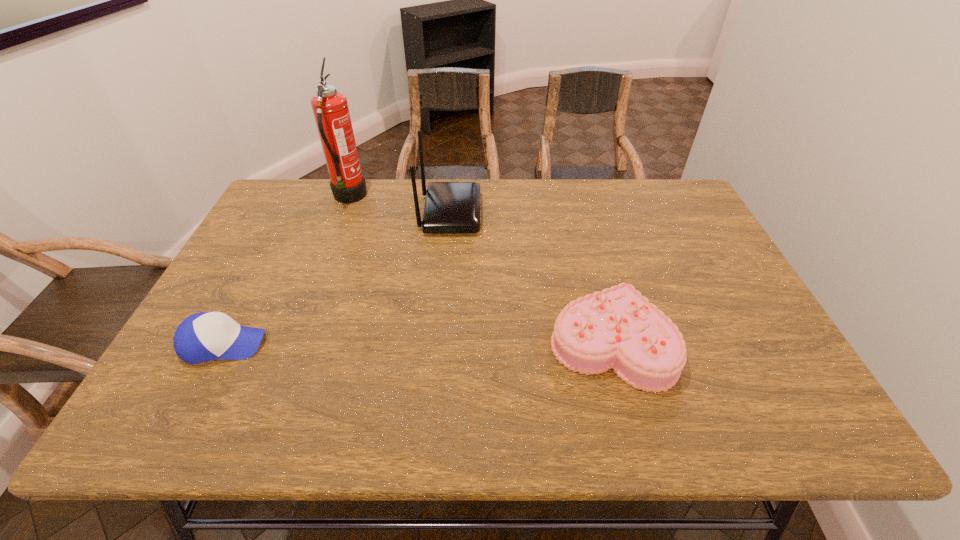
Find the location of a particular element. The image size is (960, 540). the third closest object to the rightmost object is located at coordinates tap(205, 336).

Find the location of a particular element. This screenshot has width=960, height=540. vacant space that satisfies the following two spatial constraints: 1. on the front side of the cake; 2. on the front-facing side of the baseball cap is located at coordinates (612, 345).

Identify the location of free space in the image that satisfies the following two spatial constraints: 1. on the front-facing side of the cake; 2. on the right side of the tallest object. (295, 342).

Identify the location of free point that satisfies the following two spatial constraints: 1. on the front-facing side of the rightmost object; 2. on the right side of the second object from right to left. (440, 342).